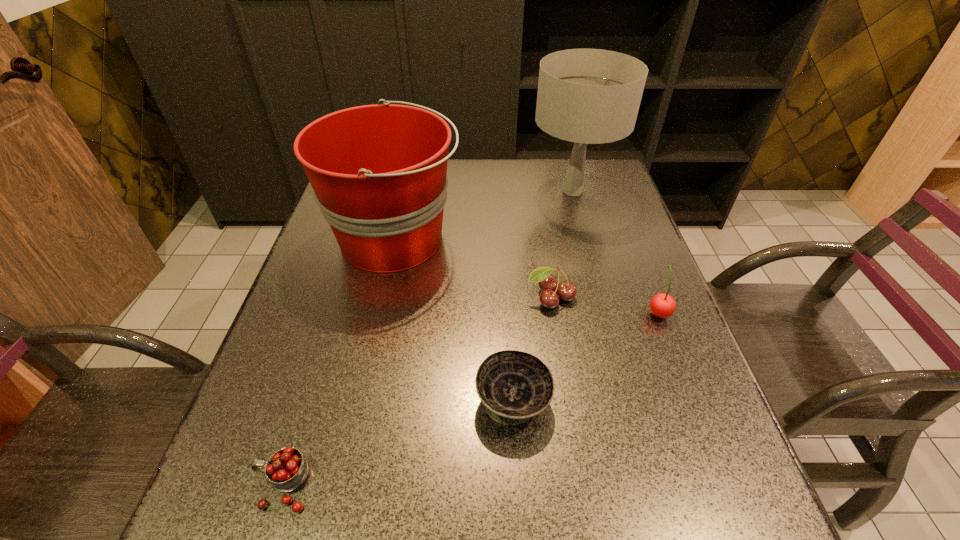
Image resolution: width=960 pixels, height=540 pixels. I want to click on cherry identified as the closest to the nearest cherry, so click(566, 290).

This screenshot has width=960, height=540. In order to click on vacant region that satisfies the following two spatial constraints: 1. on the leaves of the second cherry from left to right; 2. on the left side of the fourth shortest object in this screenshot , I will do `click(553, 312)`.

Locate an element on the screen. free location that satisfies the following two spatial constraints: 1. on the back side of the rightmost cherry; 2. on the right side of the second nearest object is located at coordinates (508, 312).

At what (x,y) coordinates should I click in order to perform the action: click on vacant area that satisfies the following two spatial constraints: 1. on the front-facing side of the lampshade; 2. on the front side of the bowl. Please return your answer as a coordinate pair (x, y). The image size is (960, 540). Looking at the image, I should click on (630, 401).